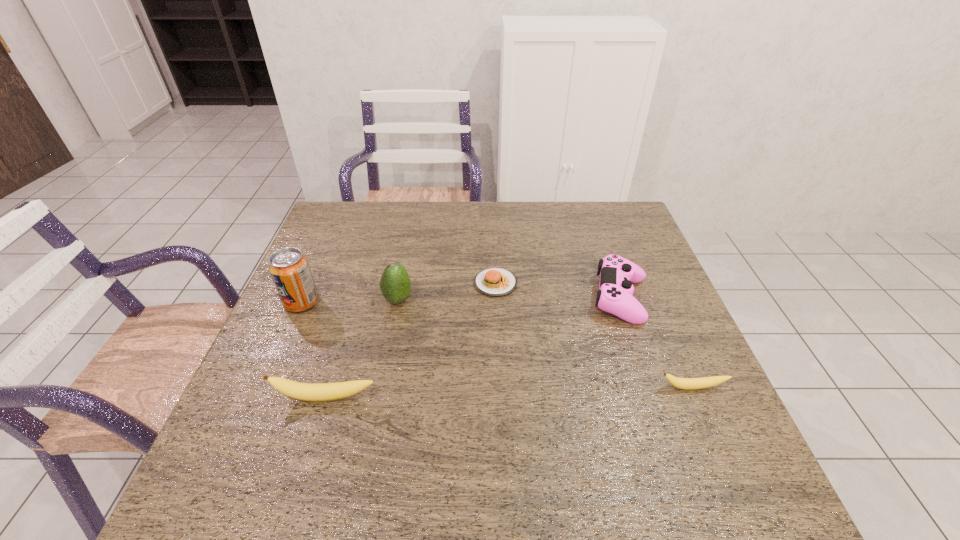
This screenshot has height=540, width=960. Find the location of `the left banana`. the left banana is located at coordinates (302, 391).

In order to click on the shorter banana in this screenshot , I will do `click(682, 383)`.

Locate an element on the screen. the fifth tallest object is located at coordinates (682, 383).

This screenshot has width=960, height=540. Find the location of `avocado`. avocado is located at coordinates (395, 285).

You are a GUI agent. You are given a task and a screenshot of the screen. Output one action in this format:
    pyautogui.click(x=<x>, y=<y>)
    Task: Click on the shortest object
    
    Given the screenshot: What is the action you would take?
    pyautogui.click(x=495, y=282)

Identify the location of the third object from right to left. (495, 282).

Image resolution: width=960 pixels, height=540 pixels. I want to click on control, so click(617, 274).

Locate an element on the screen. This screenshot has width=960, height=540. the tallest object is located at coordinates (290, 271).

At what (x,y) coordinates should I click in order to perform the action: click on vacant space located 0.110m on the upward curve of the second shortest object. Please return your answer as a coordinate pair (x, y). The image size is (960, 540). Looking at the image, I should click on (714, 438).

The height and width of the screenshot is (540, 960). I want to click on free space located on the left of the fifth shortest object, so click(x=342, y=300).